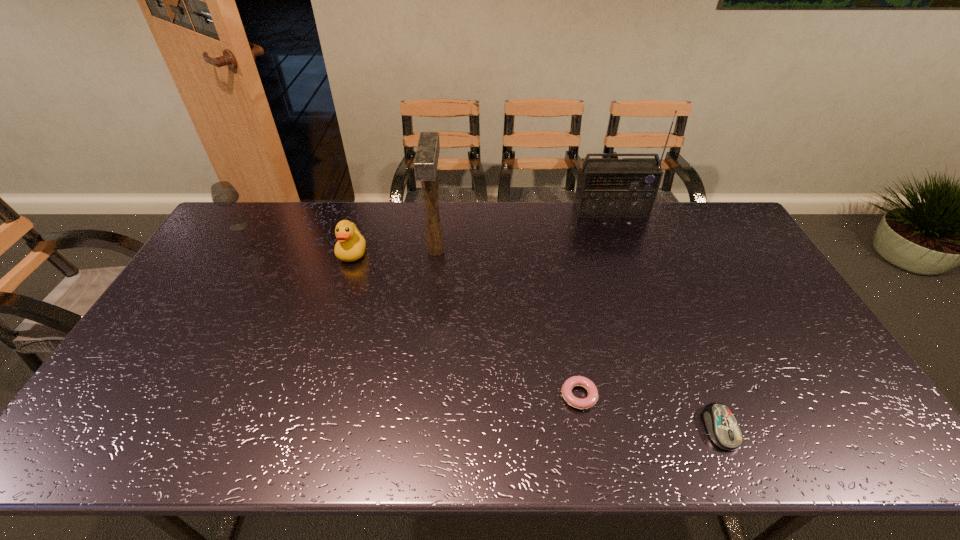
Where is `the farthest object`? The height and width of the screenshot is (540, 960). the farthest object is located at coordinates (606, 187).

Where is `mallet`? This screenshot has width=960, height=540. mallet is located at coordinates (427, 154).

Locate an element on the screen. The height and width of the screenshot is (540, 960). wineglass is located at coordinates (223, 194).

This screenshot has height=540, width=960. In order to click on the leftmost object in this screenshot , I will do `click(223, 194)`.

The height and width of the screenshot is (540, 960). Find the location of `duck`. duck is located at coordinates (350, 246).

Image resolution: width=960 pixels, height=540 pixels. What are the coordinates of `the fifth object from right to left` in the screenshot? It's located at (350, 246).

The height and width of the screenshot is (540, 960). I want to click on the second shortest object, so click(x=723, y=429).

Identify the location of the fourth object from left to right. This screenshot has width=960, height=540. (592, 398).

The height and width of the screenshot is (540, 960). Find the location of `doughnut`. doughnut is located at coordinates (592, 398).

What are the coordinates of `vacant space situated 0.320m on the front panel of the radio receiver` in the screenshot? It's located at (636, 279).